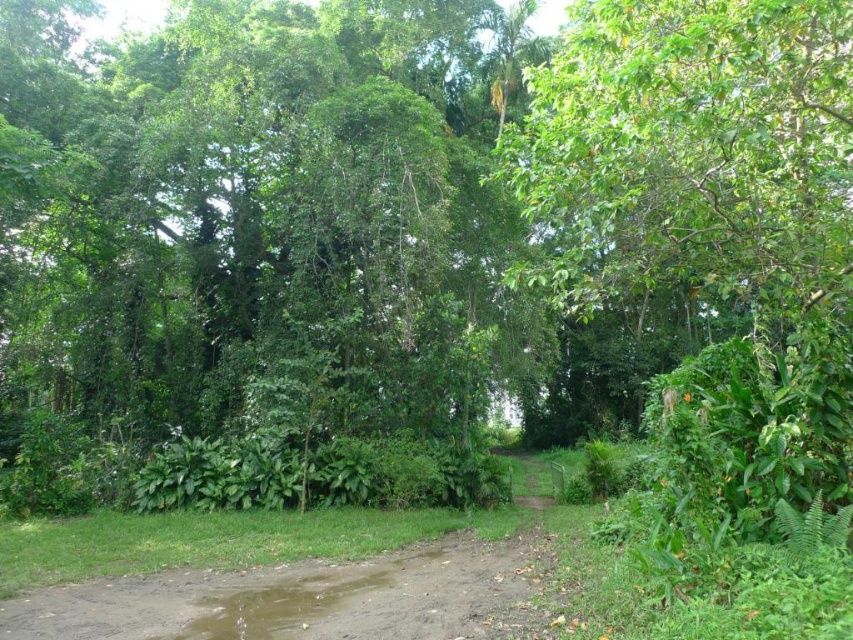
Based on the photo, who is shorter, green leafy tree at center or brown dirt track at center?

brown dirt track at center

Who is higher up, green leafy tree at center or brown dirt track at center?

green leafy tree at center

This screenshot has height=640, width=853. In order to click on green leafy tree at center in this screenshot , I will do `click(254, 209)`.